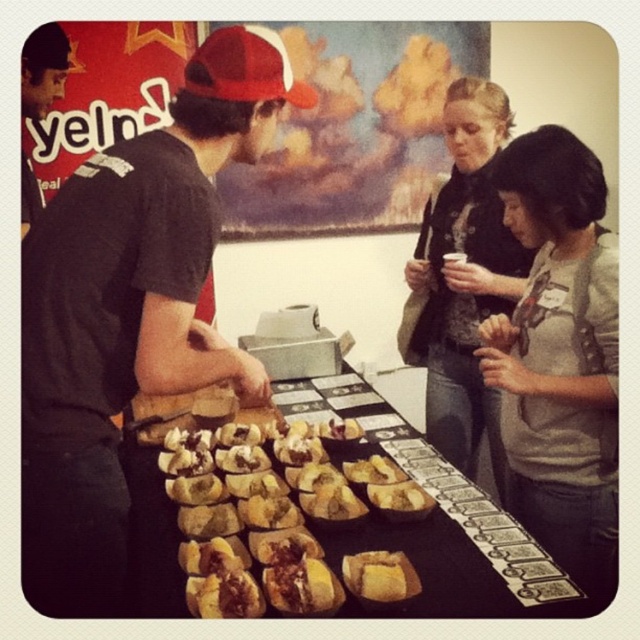
Does point (108, 202) come farther from viewer compared to point (330, 572)?

No, (108, 202) is closer to viewer.

Does matte black shirt at center come behind brown crumbly bread at center?

No.

The image size is (640, 640). What are the coordinates of `matte black shirt at center` in the screenshot? It's located at (131, 310).

Is point (488, 214) less distant than point (45, 33)?

No, it is not.

Is dark gray sweater at center to the left of matte black shirt at left from the viewer's perspective?

Incorrect, dark gray sweater at center is not on the left side of matte black shirt at left.

Locate an element on the screen. dark gray sweater at center is located at coordinates (465, 280).

Locate an element on the screen. The width and height of the screenshot is (640, 640). golden crispy bread at center is located at coordinates (280, 522).

Is point (390, 584) less distant than point (372, 550)?

Yes.

Locate an element on the screen. golden crispy bread at center is located at coordinates (280, 522).